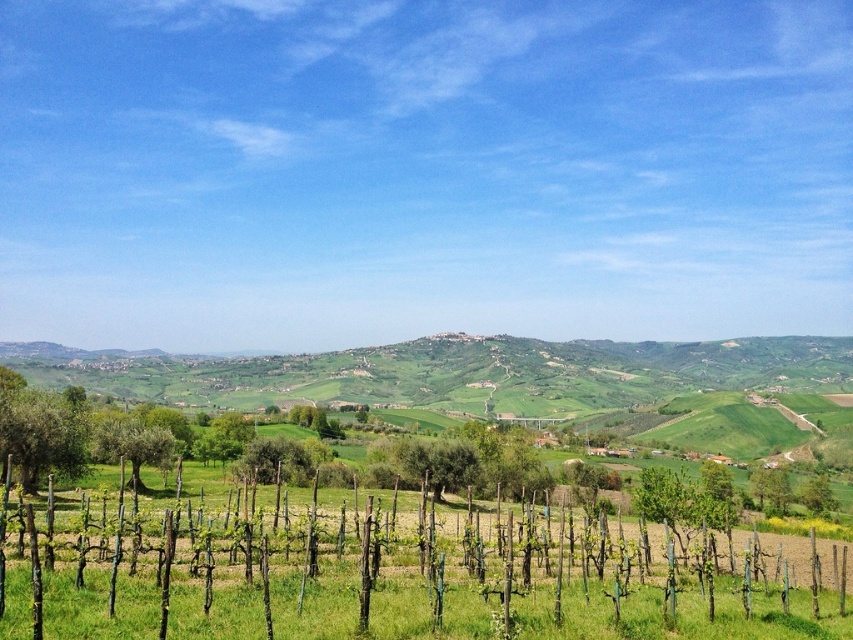
Question: Is green leafy tree at lower left wider than green rough bark tree at left?

Choices:
 (A) no
 (B) yes

Answer: (A)

Question: Can you confirm if green leafy tree at lower left is smaller than green rough bark tree at left?

Choices:
 (A) no
 (B) yes

Answer: (B)

Question: Where is green leafy tree at lower left located in relation to green rough bark tree at left in the image?

Choices:
 (A) left
 (B) right

Answer: (A)

Question: Which point is closer to the camera?

Choices:
 (A) green rough bark tree at left
 (B) green leafy tree at lower left

Answer: (B)

Question: Which point appears farthest from the camera in this image?

Choices:
 (A) (49, 416)
 (B) (111, 433)

Answer: (B)